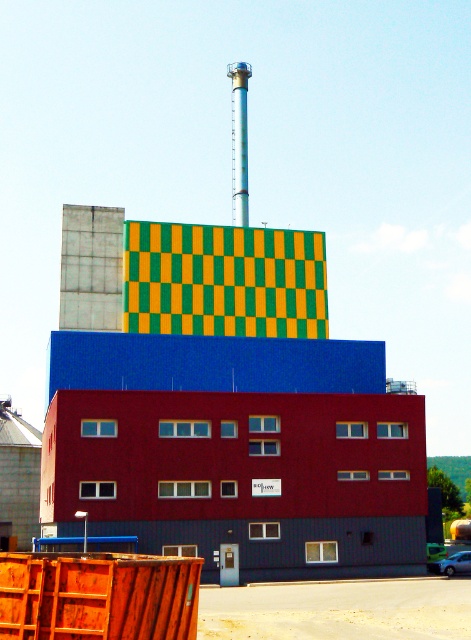
Does matte blue building at center have a greater width compared to silver metallic chimney at upper center?

Yes, matte blue building at center is wider than silver metallic chimney at upper center.

Does matte blue building at center appear on the left side of silver metallic chimney at upper center?

Correct, you'll find matte blue building at center to the left of silver metallic chimney at upper center.

Image resolution: width=471 pixels, height=640 pixels. What do you see at coordinates (234, 417) in the screenshot? I see `matte blue building at center` at bounding box center [234, 417].

Identify the location of matte blue building at center. (234, 417).

Is the position of wooden crate at lower left more distant than that of silver metallic chimney at upper center?

No, wooden crate at lower left is in front of silver metallic chimney at upper center.

Does wooden crate at lower left have a greater height compared to silver metallic chimney at upper center?

In fact, wooden crate at lower left may be shorter than silver metallic chimney at upper center.

Does point (114, 636) lie behind point (243, 124)?

No, (114, 636) is closer to viewer.

Where is `wooden crate at lower left`? The width and height of the screenshot is (471, 640). wooden crate at lower left is located at coordinates (97, 596).

Who is more distant from viewer, (91, 221) or (238, 65)?

The point (238, 65) is more distant.

The width and height of the screenshot is (471, 640). In order to click on smooth concrete chimney at upper center in this screenshot , I will do `click(90, 268)`.